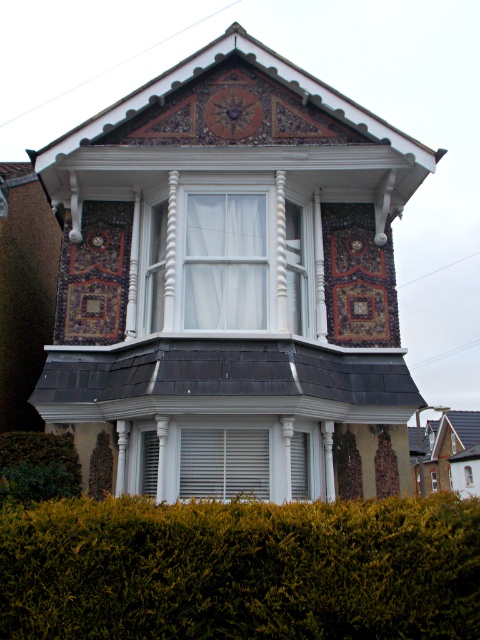
Question: Based on their relative distances, which object is farther from the clear glass window at center?

Choices:
 (A) white matte window at center
 (B) green leafy hedge at lower center
 (C) white wood bay window at center
 (D) green leafy hedge at lower left

Answer: (B)

Question: Can you confirm if white matte window at center is smaller than transparent glass window at upper center?

Choices:
 (A) no
 (B) yes

Answer: (A)

Question: Does green leafy hedge at lower left have a larger size compared to clear glass window at center?

Choices:
 (A) no
 (B) yes

Answer: (B)

Question: Which of the following is the farthest from the observer?

Choices:
 (A) white matte window at center
 (B) green leafy hedge at lower left

Answer: (A)

Question: Does white matte window at center have a lesser width compared to transparent glass window at upper center?

Choices:
 (A) no
 (B) yes

Answer: (A)

Question: Estimate the real-world distances between objects in this image. Which object is closer to the green leafy hedge at lower center?

Choices:
 (A) transparent glass window at upper center
 (B) green leafy hedge at lower left
 (C) clear glass window at center

Answer: (B)